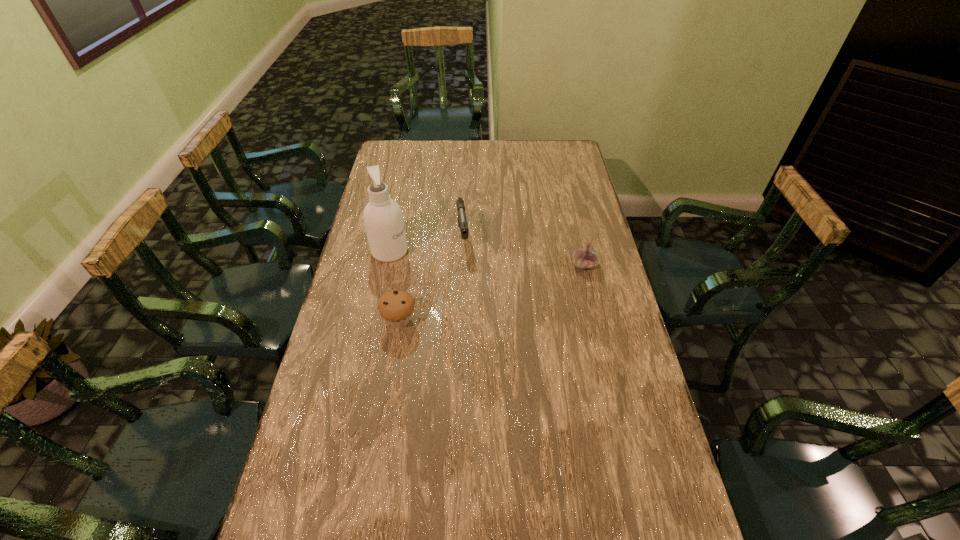
You are a GUI agent. You are given a task and a screenshot of the screen. Output one action in this format:
    pyautogui.click(x=<x>, y=<y>)
    Task: Click on the free space on the desktop that is between the nearest object and the rightmost object and is positioned in the direction the second object from right to left is aimed
    
    Given the screenshot: What is the action you would take?
    pyautogui.click(x=472, y=299)

You are a GUI agent. You are given a task and a screenshot of the screen. Output one action in this format:
    pyautogui.click(x=<x>, y=<y>)
    Task: Click on the free space on the desktop that is between the muffin and the rightmost object and is positioned on the front label of the tallest object
    
    Given the screenshot: What is the action you would take?
    pyautogui.click(x=517, y=285)